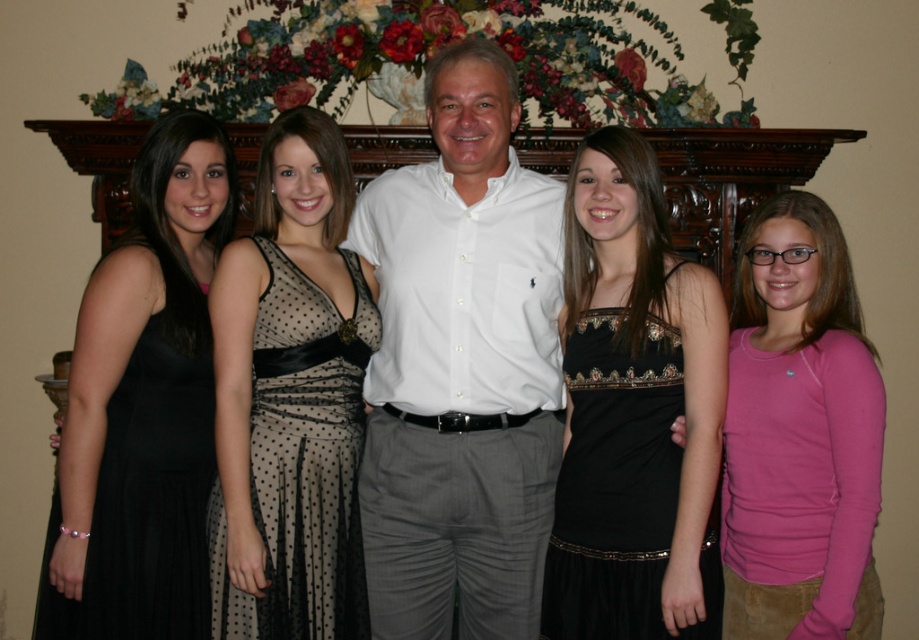
You are a photographer at a fashion show. You need to arrange two models wearing black satin dresses in a line. The first model is wearing the black satin dress at left, and the second is wearing the black satin dress at center. According to the scene, should the second model stand to the right or left of the first model?

The black satin dress at center is to the right of the black satin dress at left, so the second model should stand to the right of the first model.